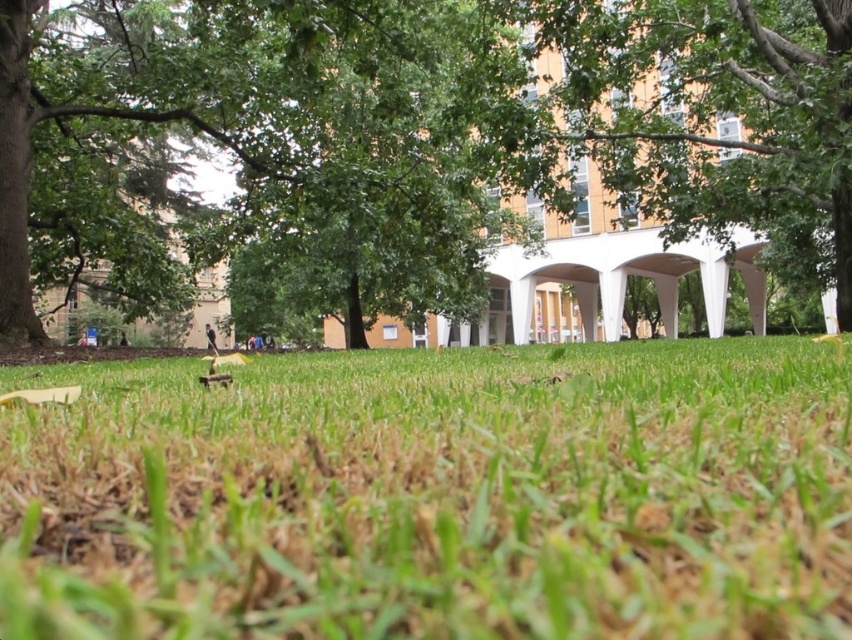
Question: Is green grass at center to the right of green leafy tree at center from the viewer's perspective?

Choices:
 (A) yes
 (B) no

Answer: (B)

Question: Is green grass at center positioned behind green leafy tree at center?

Choices:
 (A) no
 (B) yes

Answer: (A)

Question: Which point is closer to the camera?

Choices:
 (A) green grass at center
 (B) green leafy tree at center

Answer: (A)

Question: Is green grass at center to the left of green leafy tree at center from the viewer's perspective?

Choices:
 (A) no
 (B) yes

Answer: (B)

Question: Which of the following is the closest to the observer?

Choices:
 (A) green grass at center
 (B) green leafy tree at center

Answer: (A)